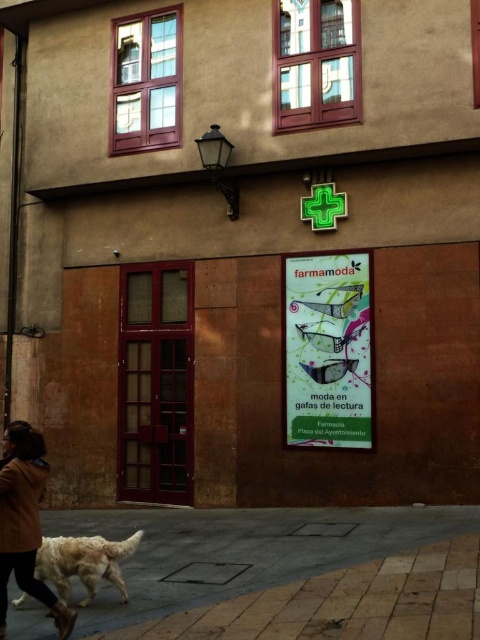
Can you confirm if brown leather jacket at lower left is thinner than golden fur dog at lower left?

Yes, brown leather jacket at lower left is thinner than golden fur dog at lower left.

Does brown leather jacket at lower left appear over golden fur dog at lower left?

Correct, brown leather jacket at lower left is located above golden fur dog at lower left.

Is point (20, 456) positioned before point (101, 576)?

Yes, it is in front of point (101, 576).

You are a GUI agent. You are given a task and a screenshot of the screen. Output one action in this format:
    pyautogui.click(x=<x>, y=<y>)
    Task: Click on the brown leather jacket at lower left
    
    Given the screenshot: What is the action you would take?
    pyautogui.click(x=24, y=522)

Does matte paper poster at center have a greater height compared to brown leather jacket at lower left?

Yes.

Between matte paper poster at center and brown leather jacket at lower left, which one has more height?

Standing taller between the two is matte paper poster at center.

Identify the location of matte paper poster at center. The image size is (480, 640). (327, 349).

Locate an element on the screen. Image resolution: width=480 pixels, height=640 pixels. matte paper poster at center is located at coordinates (327, 349).

Does brick pavement at lower center come in front of matte paper poster at center?

Yes, it is.

Is point (382, 540) more distant than point (330, 403)?

No, it is in front of (330, 403).

You are a GUI agent. You are given a task and a screenshot of the screen. Output one action in this format:
    pyautogui.click(x=<x>, y=<y>)
    Task: Click on the brick pavement at lower center
    
    Given the screenshot: What is the action you would take?
    pyautogui.click(x=241, y=550)